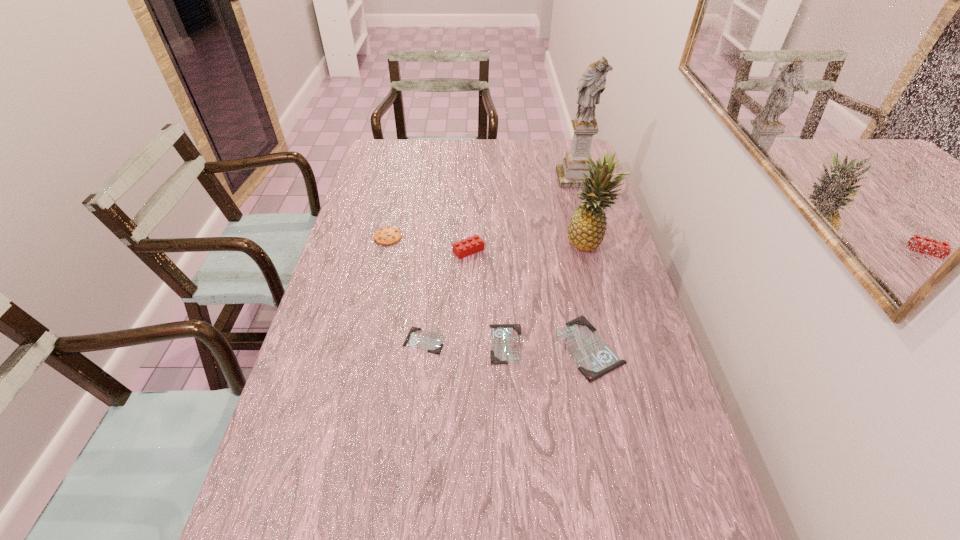
Identify the location of vacant area at the far left corner. (404, 150).

Find the location of `free spot between the farthest object and the fifth object from right to left`. free spot between the farthest object and the fifth object from right to left is located at coordinates (522, 214).

Locate an element on the screen. This screenshot has width=960, height=540. vacant region between the shortest identity card and the fifth object from right to left is located at coordinates (446, 295).

Image resolution: width=960 pixels, height=540 pixels. In order to click on vacant space that's between the fourth object from left to right and the tallest identity card in this screenshot , I will do `click(547, 346)`.

Image resolution: width=960 pixels, height=540 pixels. I want to click on free spot between the rightmost identity card and the third object from left to right, so coord(529,299).

Find the location of a particular element. free space between the Lego and the fourth tallest object is located at coordinates (428, 244).

The image size is (960, 540). I want to click on free space between the third shortest object and the sixth shortest object, so click(x=588, y=295).

Where is `free area in between the cookie and the rightmost identity card`? The width and height of the screenshot is (960, 540). free area in between the cookie and the rightmost identity card is located at coordinates (489, 292).

Identify the location of unoccupied area between the sixth shortest object and the third tallest object. pyautogui.click(x=528, y=247).

Where is `empty space between the fourth shortest object and the pineapple`? empty space between the fourth shortest object and the pineapple is located at coordinates (488, 240).